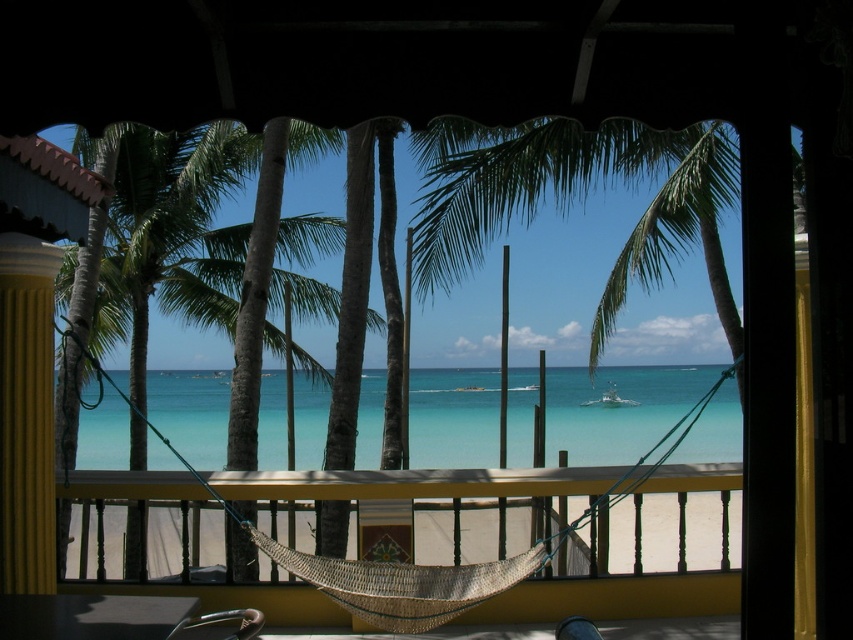
Question: In this image, where is clear blue water at center located relative to woven rope hammock at center?

Choices:
 (A) above
 (B) below

Answer: (B)

Question: Is clear blue water at center to the left of woven rope hammock at center from the viewer's perspective?

Choices:
 (A) yes
 (B) no

Answer: (A)

Question: Which of the following is the closest to the observer?

Choices:
 (A) (225, 600)
 (B) (677, 392)

Answer: (A)

Question: Which of the following is the farthest from the observer?

Choices:
 (A) woven rope hammock at center
 (B) clear blue water at center

Answer: (B)

Question: Can you confirm if clear blue water at center is positioned to the right of woven rope hammock at center?

Choices:
 (A) no
 (B) yes

Answer: (A)